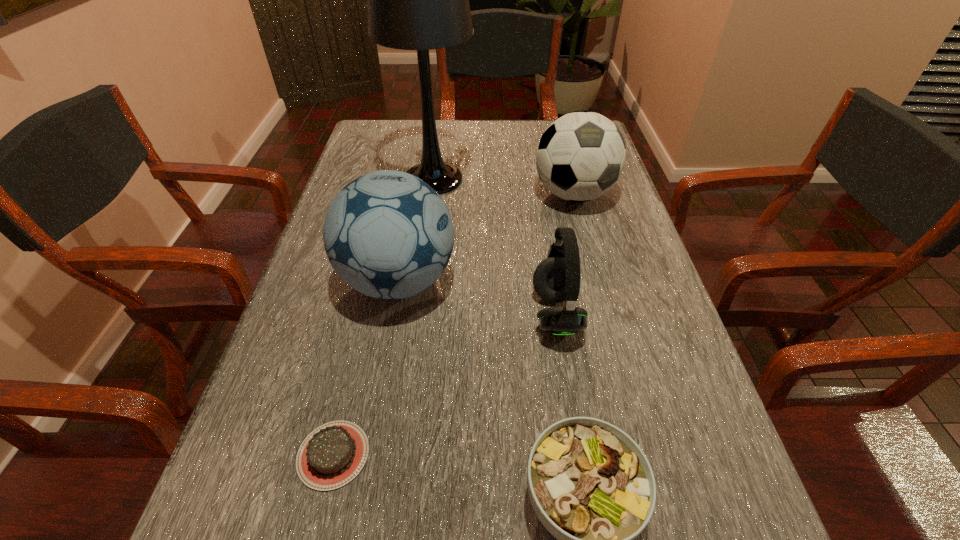
Where is `free space at the right edge of the desktop`? This screenshot has height=540, width=960. free space at the right edge of the desktop is located at coordinates (654, 287).

The image size is (960, 540). I want to click on free space at the far left corner, so click(x=408, y=145).

Identify the location of blank region between the farther soccer ball and the table lamp. (504, 187).

Locate an element on the screen. free space between the left soccer ball and the shortest object is located at coordinates 366,368.

The image size is (960, 540). What are the coordinates of `free space that is in between the right soccer ball and the tallest object` in the screenshot? It's located at (504, 187).

At what (x,y) coordinates should I click in order to perform the action: click on free space between the headset and the chocolate cake. Please return your answer as a coordinate pair (x, y). Image resolution: width=960 pixels, height=540 pixels. Looking at the image, I should click on (444, 384).

The image size is (960, 540). I want to click on vacant area between the headset and the chocolate cake, so click(x=444, y=384).

Image resolution: width=960 pixels, height=540 pixels. Find the location of `free spot between the table lamp and the farther soccer ball`. free spot between the table lamp and the farther soccer ball is located at coordinates (504, 187).

Identify the location of the third closest object to the tallest object. Image resolution: width=960 pixels, height=540 pixels. (556, 279).

Identify which object is the third nearest to the tallest object. Please provide its 2D coordinates. Your answer should be formatted as a tuple, i.e. [(x, y)], where the tuple contains the x and y coordinates of a point satisfying the conditions above.

[(556, 279)]